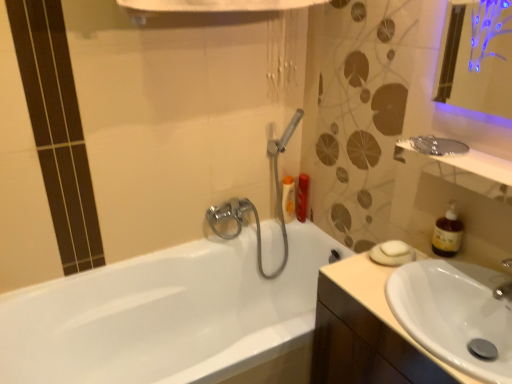
Where is `vacant space that is to the left of white matte soap at right`? The height and width of the screenshot is (384, 512). vacant space that is to the left of white matte soap at right is located at coordinates (353, 271).